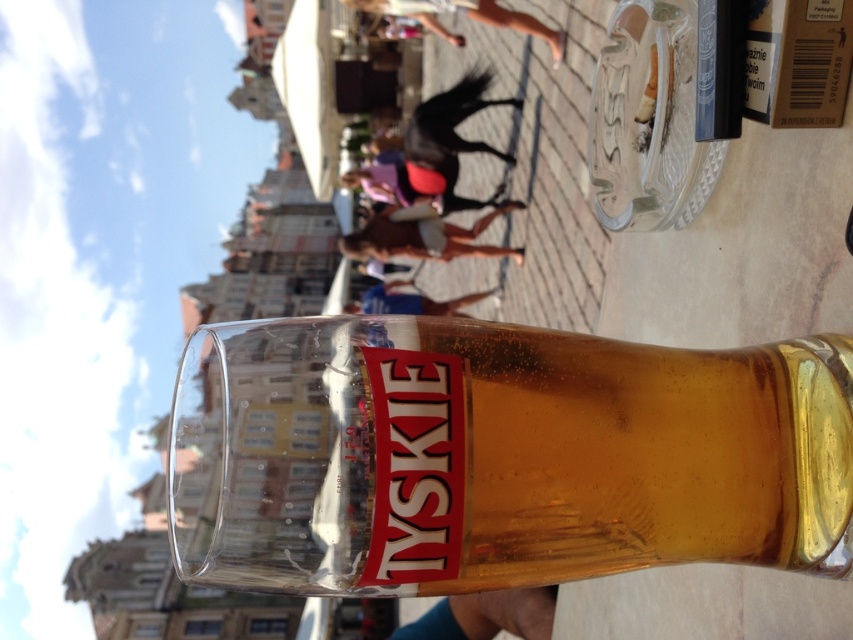
Question: Does translucent glass mug at center appear on the left side of tan fabric shorts at center?

Choices:
 (A) no
 (B) yes

Answer: (A)

Question: Which of these objects is positioned closest to the smooth skin person at center?

Choices:
 (A) skinny jeans at upper center
 (B) tan fabric shorts at center
 (C) translucent glass mug at center

Answer: (B)

Question: Which point is farther to the camera?

Choices:
 (A) (231, 472)
 (B) (398, 284)
 (C) (357, 252)

Answer: (B)

Question: Which of these objects is positioned closest to the tan fabric shorts at center?

Choices:
 (A) smooth skin person at center
 (B) translucent glass mug at center
 (C) skinny jeans at upper center

Answer: (A)

Question: Does tan fabric shorts at center appear over skinny jeans at upper center?

Choices:
 (A) no
 (B) yes

Answer: (A)

Question: Can you confirm if translucent glass mug at center is positioned above skinny jeans at upper center?

Choices:
 (A) yes
 (B) no

Answer: (B)